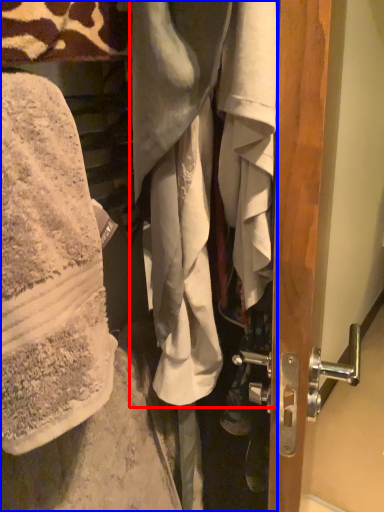
Question: Which of the following is the closest to the observer, wrap (highlighted by a red box) or wrap (highlighted by a blue box)?

Choices:
 (A) wrap
 (B) wrap

Answer: (B)